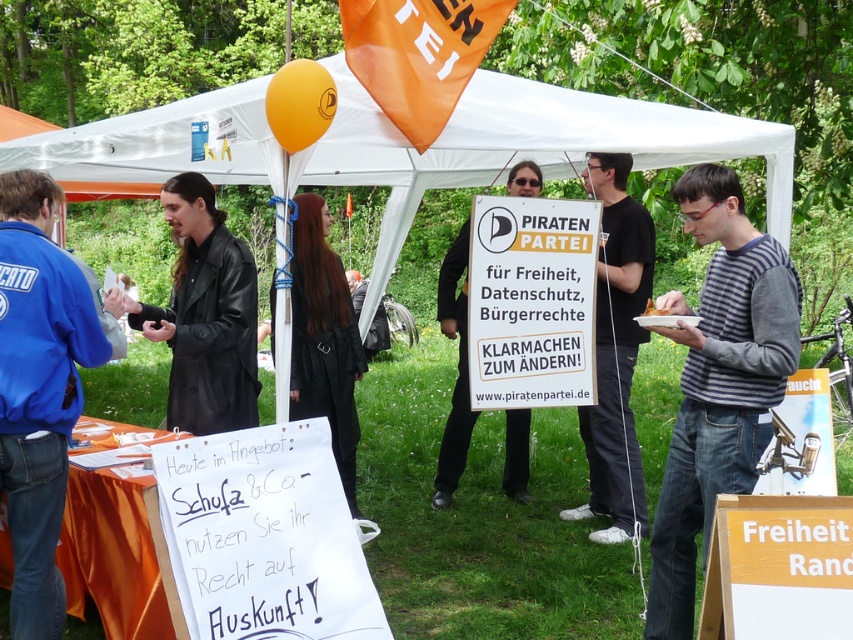
Can you confirm if white fabric canopy at upper center is positioned above black leather coat at center?

Yes.

Between white fabric canopy at upper center and black leather coat at center, which one is positioned lower?

black leather coat at center

Where is `white fabric canopy at upper center`? The width and height of the screenshot is (853, 640). white fabric canopy at upper center is located at coordinates (523, 147).

Which is more to the left, white paper sign at center or black leather coat at center?

black leather coat at center

Can you confirm if white paper sign at center is taller than black leather coat at center?

No, white paper sign at center is not taller than black leather coat at center.

This screenshot has width=853, height=640. Describe the element at coordinates (531, 301) in the screenshot. I see `white paper sign at center` at that location.

The width and height of the screenshot is (853, 640). I want to click on white paper sign at center, so click(531, 301).

Does white paper sign at center have a lesser width compared to black matte sign at center?

Incorrect, white paper sign at center's width is not less than black matte sign at center's.

Which is in front, point (555, 369) or point (525, 189)?

Point (555, 369) is in front.

Find the location of a particular element. This screenshot has width=853, height=640. white paper sign at center is located at coordinates (531, 301).

Find the location of a particular element. The height and width of the screenshot is (640, 853). white paper sign at center is located at coordinates (531, 301).